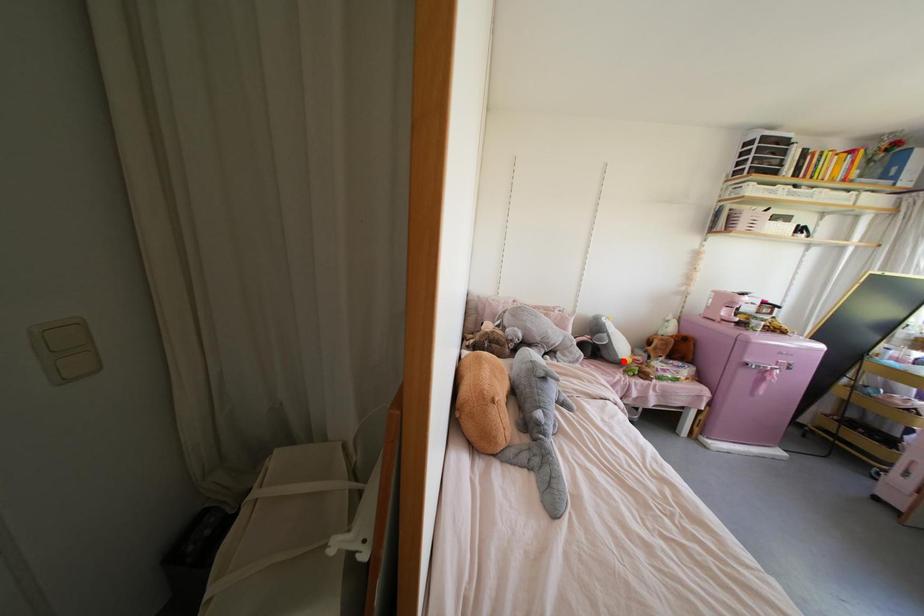
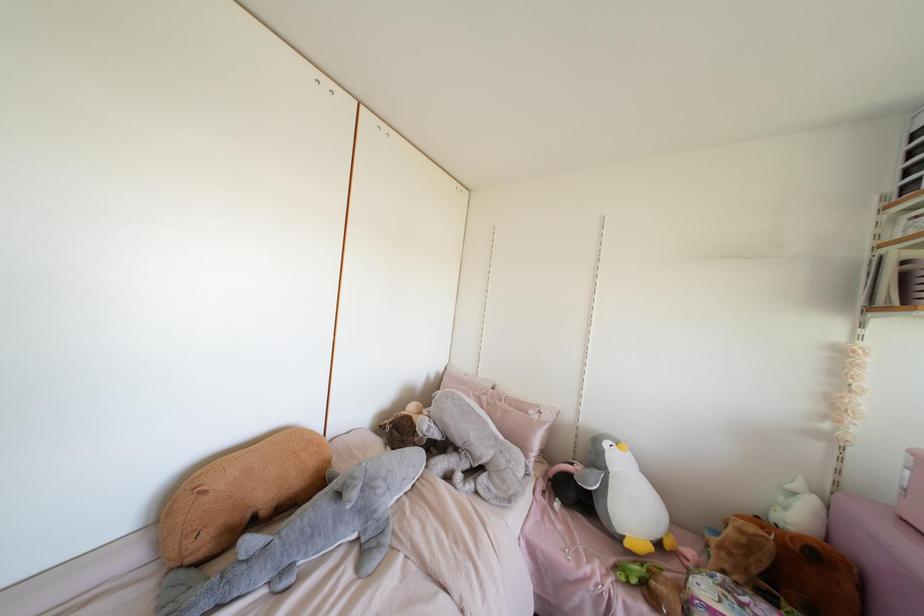
Where in the second image is the point corresponding to the highlighted location from the first image?

(626, 544)